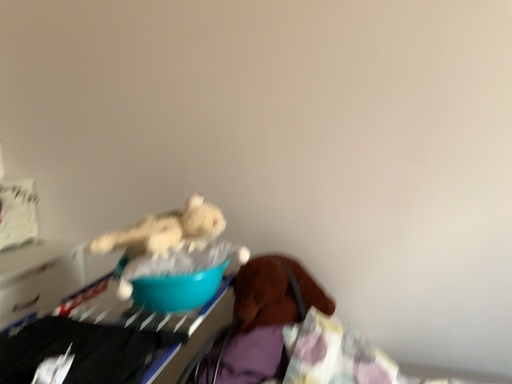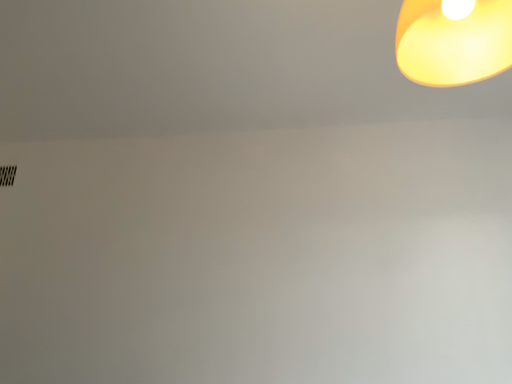
Question: How did the camera likely rotate when shooting the video?

Choices:
 (A) rotated right
 (B) rotated left

Answer: (A)